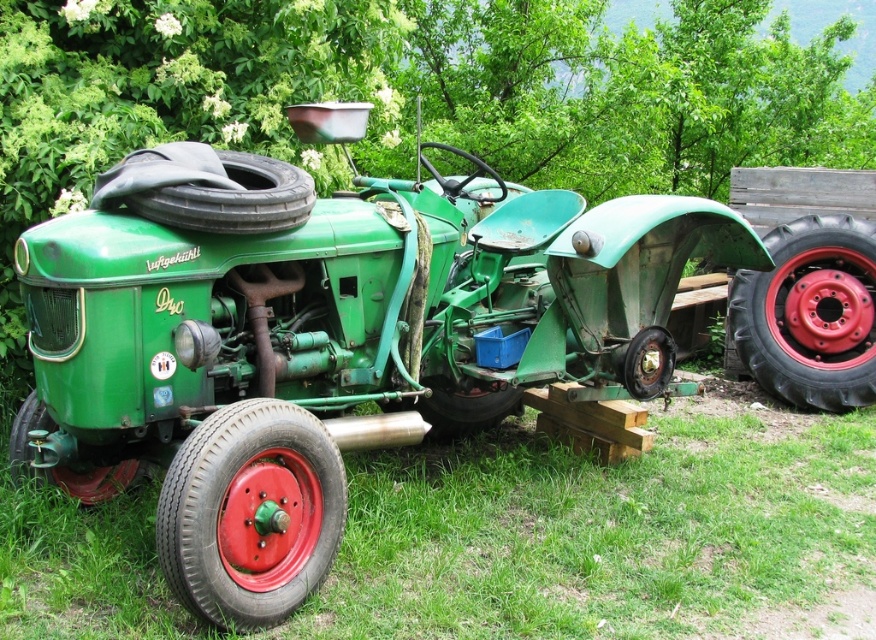
Question: In this image, where is red rubber tire at lower left located relative to red rubber tire at lower center?

Choices:
 (A) below
 (B) above

Answer: (A)

Question: Where is green grass at lower left located in relation to rubber/tire at right in the image?

Choices:
 (A) above
 (B) below

Answer: (B)

Question: Which point is closer to the camera?

Choices:
 (A) black rubber tire at center
 (B) rubber/smooth tire at lower left
 (C) green matte tractor at center

Answer: (C)

Question: In this image, where is green matte tractor at center located relative to red rubber tire at lower center?

Choices:
 (A) below
 (B) above

Answer: (B)

Question: Which point is closer to the camera?

Choices:
 (A) (325, 499)
 (B) (83, 477)
 (C) (858, 368)

Answer: (A)

Question: Estimate the real-world distances between objects in this image. Which object is closer to the red rubber tire at lower left?

Choices:
 (A) rubber/tire at right
 (B) green matte tractor at center

Answer: (B)